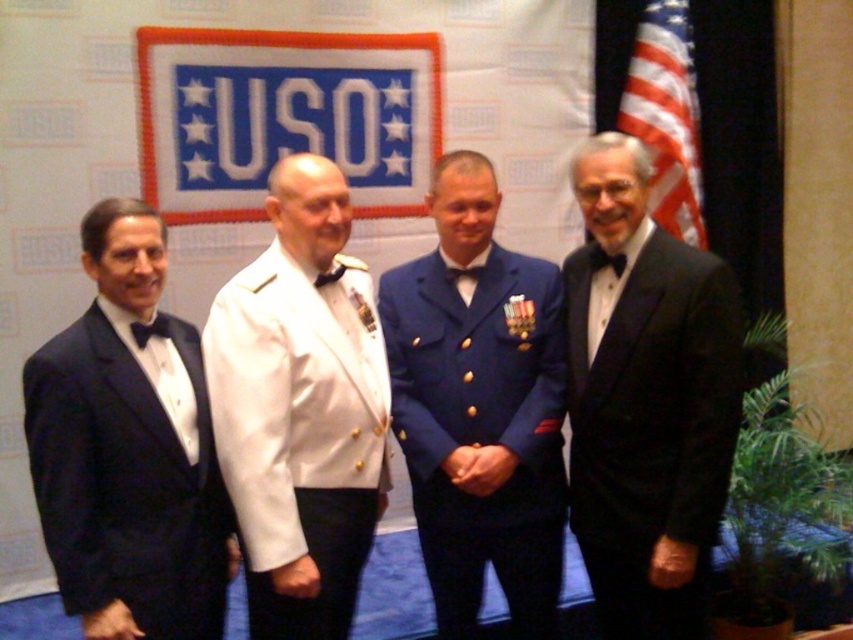
You are a photographer at this event and need to ensure all participants are visible in the photo. Given that the white glossy uniform at center and the blue fabric uniform at center are both at the center, which one might block the view of the other? Please explain based on their sizes.

The white glossy uniform at center is larger in size than the blue fabric uniform at center, so it might block the view of the blue fabric uniform at center if positioned in front.

You are a photographer arranging a group photo. You have two key figures to position correctly based on their attire. The black satin tuxedo at right and the blue fabric uniform at center need to be placed according to their positions in the scene. Which figure is standing to the right of the other?

The black satin tuxedo at right is positioned on the right side of the blue fabric uniform at center, so the black satin tuxedo at right is to the right of the blue fabric uniform at center.

Looking at this image, you are a photographer setting up for a group photo. You need to ensure there is enough space between the blue fabric uniform at center and the matte black tuxedo at left for a professional pose. The minimum required space between subjects is 24 inches. Based on the scene, will the current spacing work?

The blue fabric uniform at center and the matte black tuxedo at left are 24.82 inches apart, which exceeds the minimum required space of 24 inches. Therefore, the current spacing is sufficient for a professional pose.